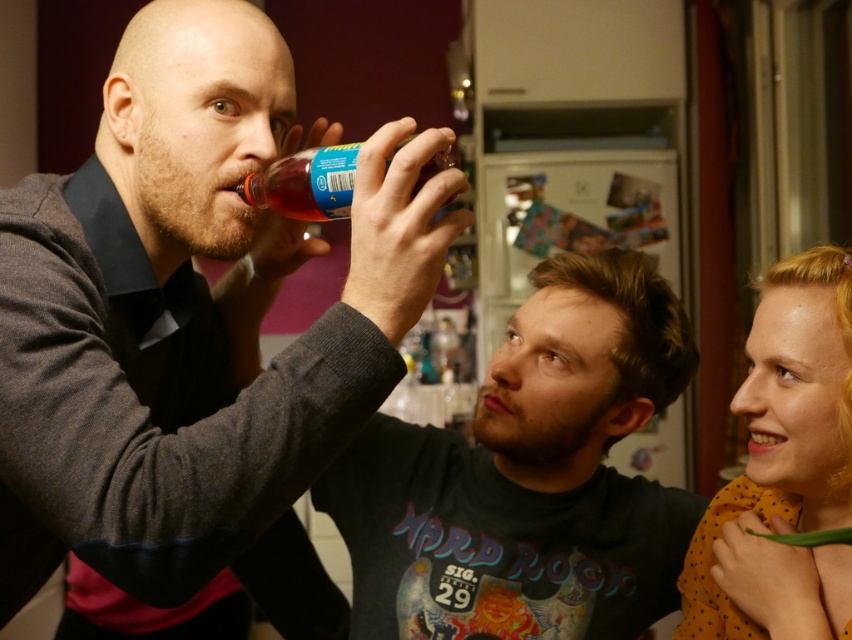
In the scene shown: You are a delivery person who needs to place a 60 cm wide package between the matte black bottle at upper left and the polka dot fabric at right. Can you fit it there?

The distance between the matte black bottle at upper left and the polka dot fabric at right is 58.97 centimeters, which is less than the 60 cm width of the package. Therefore, the package cannot fit in that space.

You are standing in front of a kitchen scene with three people. You see a polka dot fabric at right. Can you reach it with your outstretched hand?

The polka dot fabric at right is 32.94 inches away from you, so yes, you can reach it with your outstretched hand since it is within arm reach.

You are a bartender preparing drinks and need to place a coaster made of polka dot fabric at right under the matte black bottle at upper left. Will the coaster fit under the bottle?

The matte black bottle at upper left is larger in size than the polka dot fabric at right, so the coaster may not be large enough to fully cover the bottom of the bottle.